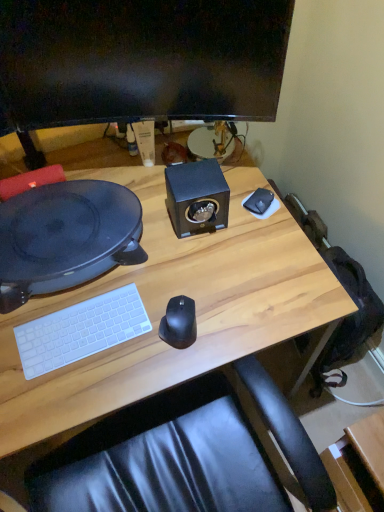
This screenshot has height=512, width=384. Identify the location of vacant space in between white matte keyboard at lower left and black plastic record player at left. (97, 294).